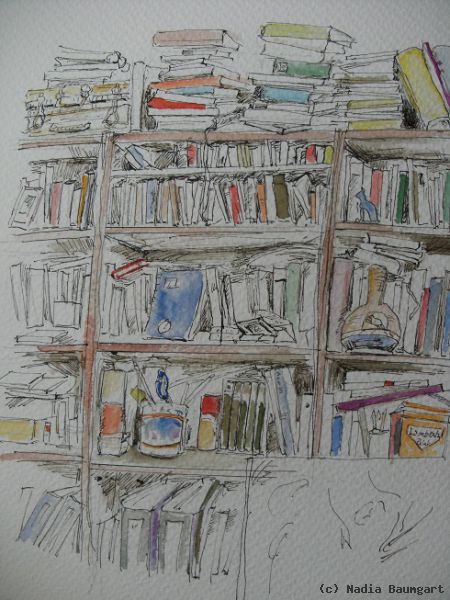
Where is `blue notebook`? Image resolution: width=450 pixels, height=600 pixels. blue notebook is located at coordinates (174, 302).